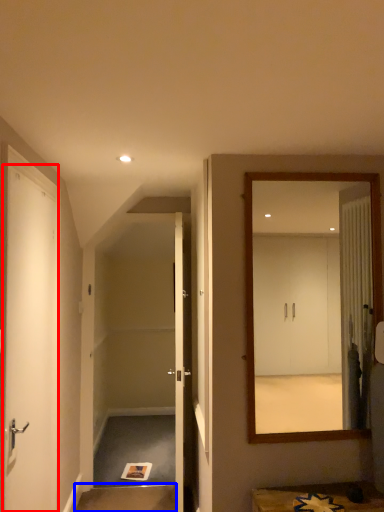
Question: Which of the following is the closest to the observer, door (highlighted by a red box) or stair (highlighted by a blue box)?

Choices:
 (A) door
 (B) stair

Answer: (A)